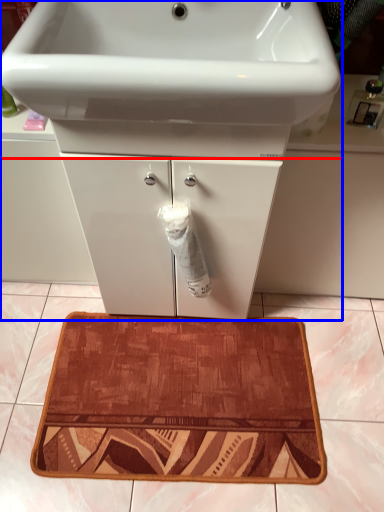
Question: Which of the following is the closest to the observer, sink (highlighted by a red box) or bathroom cabinet (highlighted by a blue box)?

Choices:
 (A) sink
 (B) bathroom cabinet

Answer: (A)